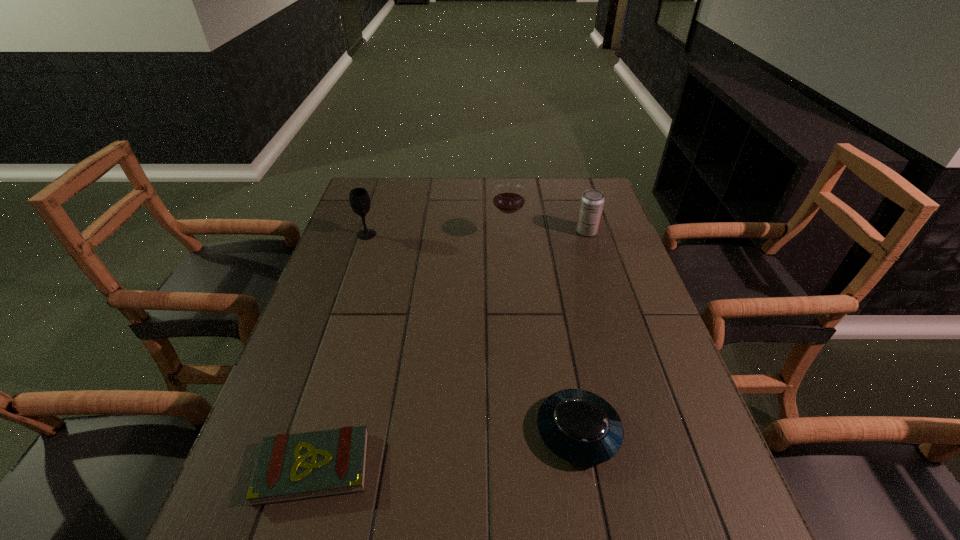
Find the location of a particular element. This screenshot has width=960, height=540. vacant space that satisfies the following two spatial constraints: 1. on the back side of the book; 2. on the left side of the rightmost object is located at coordinates 382,231.